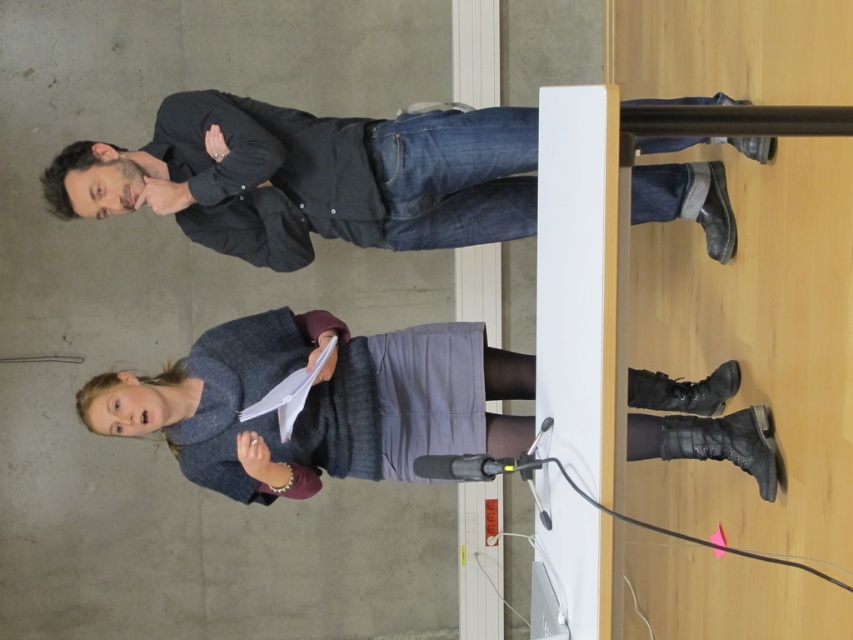
Question: Among these points, which one is nearest to the camera?

Choices:
 (A) (248, 396)
 (B) (519, 150)

Answer: (B)

Question: In this image, where is dark gray shirt at upper left located relative to gray wool skirt at center?

Choices:
 (A) above
 (B) below

Answer: (A)

Question: Is dark gray shirt at upper left smaller than gray wool skirt at center?

Choices:
 (A) no
 (B) yes

Answer: (B)

Question: Which point is closer to the camera taking this photo?

Choices:
 (A) (234, 397)
 (B) (418, 134)

Answer: (B)

Question: Does dark gray shirt at upper left appear over gray wool skirt at center?

Choices:
 (A) yes
 (B) no

Answer: (A)